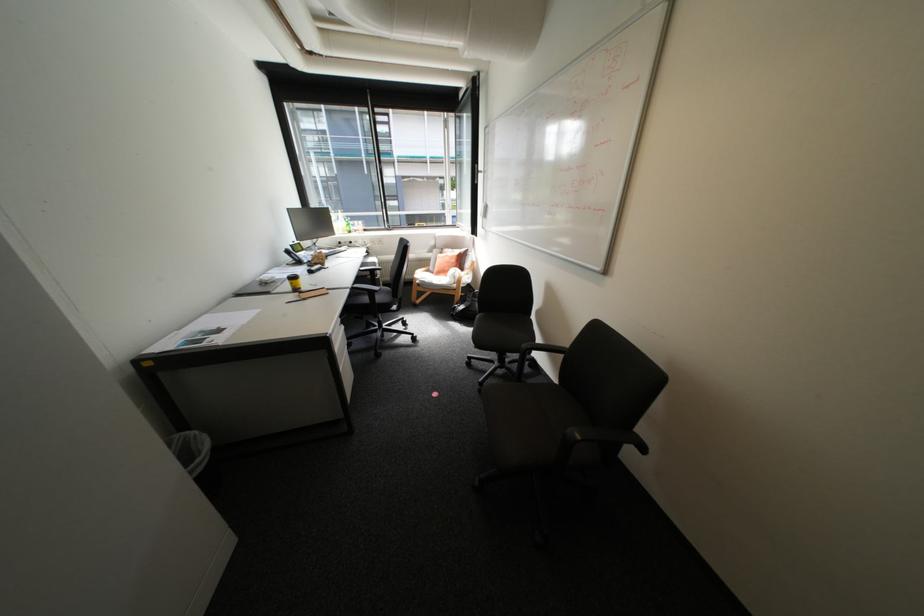
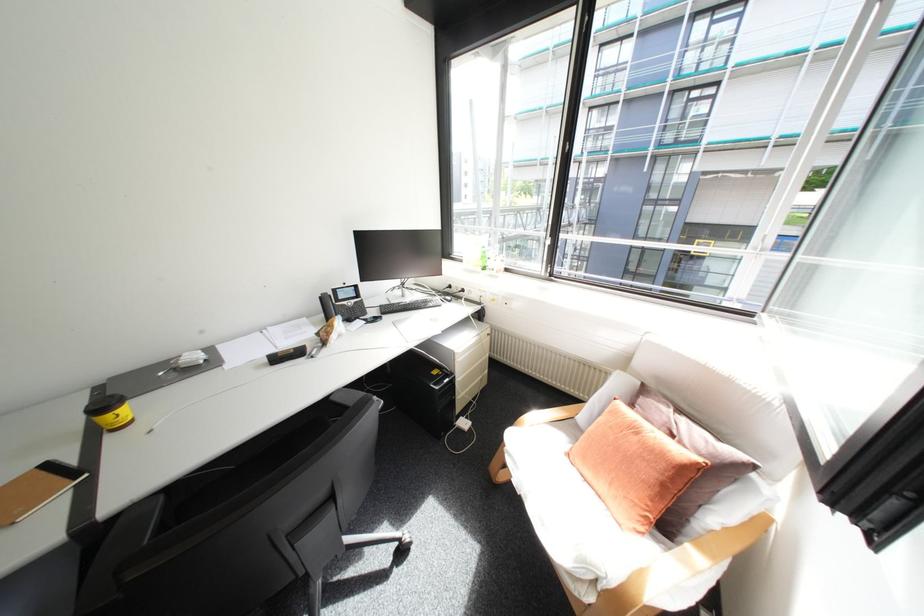
Where in the second image is the point corresponding to point 459,249 from the first image?

(677, 410)